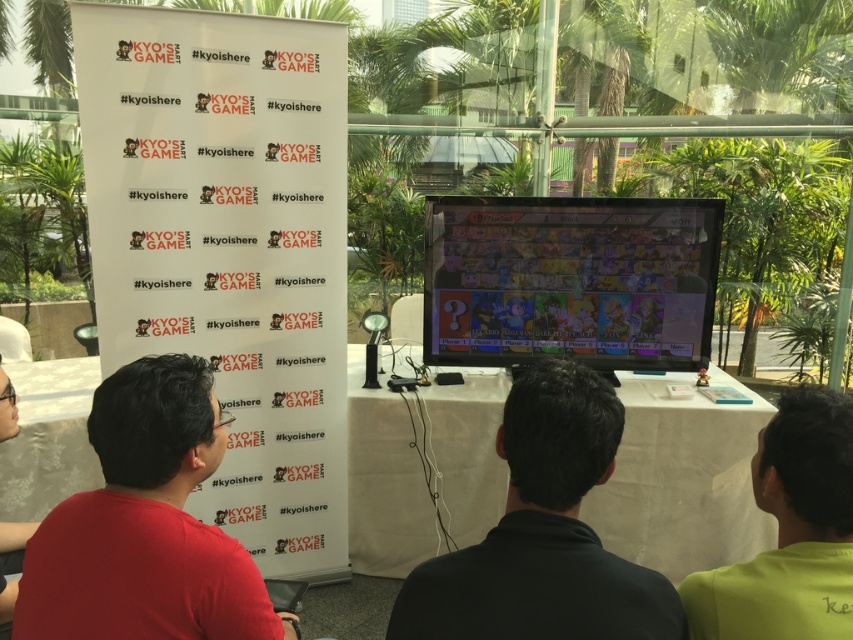
What do you see at coordinates (144, 525) in the screenshot? I see `matte red shirt at left` at bounding box center [144, 525].

Which is more to the left, matte red shirt at left or green matte shirt at lower right?

Positioned to the left is matte red shirt at left.

Between point (149, 452) and point (833, 637), which one is positioned in front?

Point (833, 637) is in front.

At what (x,y) coordinates should I click in order to perform the action: click on matte red shirt at left. Please return your answer as a coordinate pair (x, y). Looking at the image, I should click on (144, 525).

Is matte plastic tv at center positioned before green matte shirt at lower right?

No, matte plastic tv at center is further to the viewer.

Measure the distance between point (x=637, y=211) and camera.

They are 2.60 meters apart.

You are a GUI agent. You are given a task and a screenshot of the screen. Output one action in this format:
    pyautogui.click(x=<x>, y=<y>)
    Task: Click on the matte plastic tv at center
    The width and height of the screenshot is (853, 640).
    Given the screenshot: What is the action you would take?
    pyautogui.click(x=570, y=280)

Is matte plastic tv at center positioned in front of black matte shirt at center?

No, it is behind black matte shirt at center.

Which is behind, point (633, 307) or point (505, 605)?

Positioned behind is point (633, 307).

This screenshot has height=640, width=853. In order to click on matte plastic tv at center in this screenshot , I will do [570, 280].